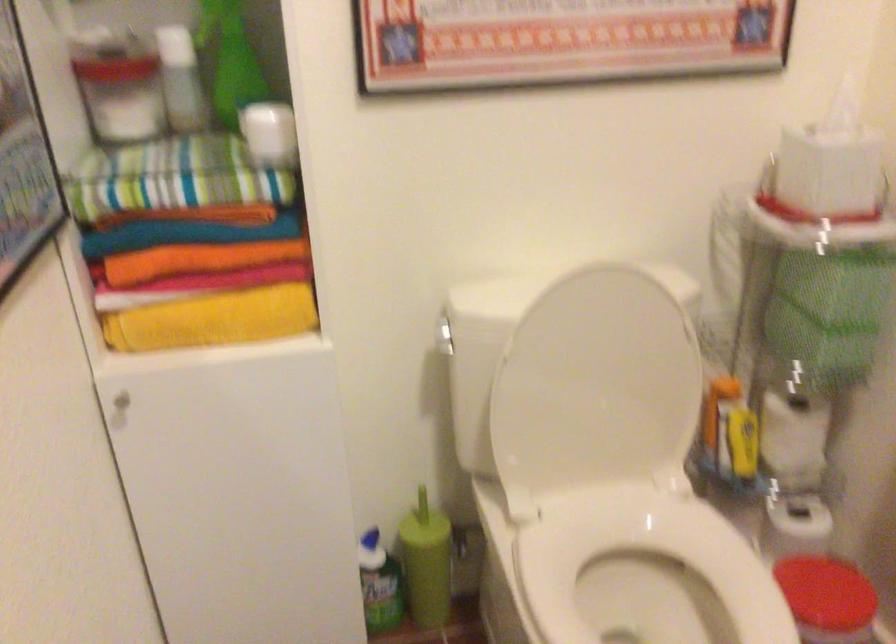
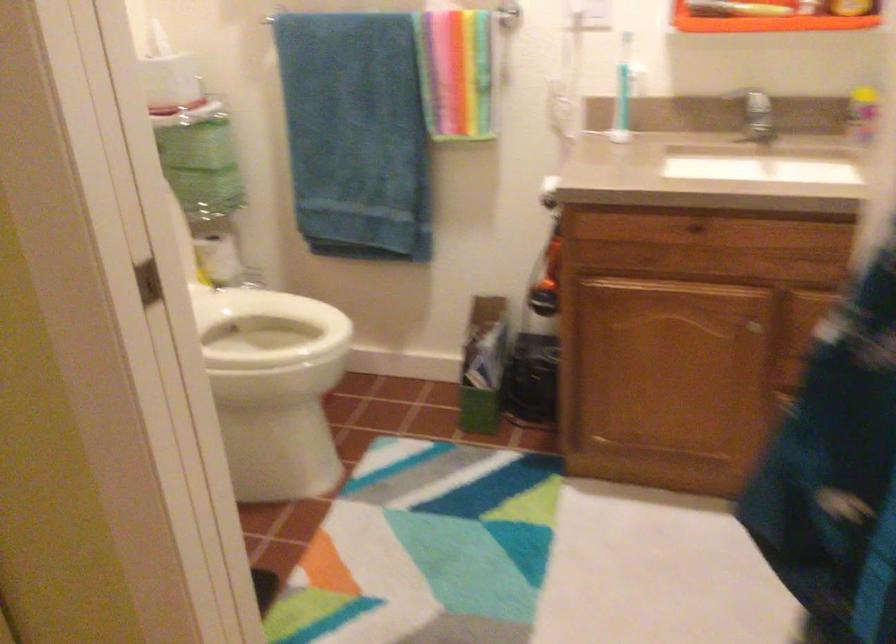
Question: I am providing you with two images of the same scene from different viewpoints. Which of the following objects are not visible in image2?

Choices:
 (A) black laundry hamper
 (B) silver faucet handle
 (C) toilet paper roll
 (D) white toilet lid

Answer: (D)